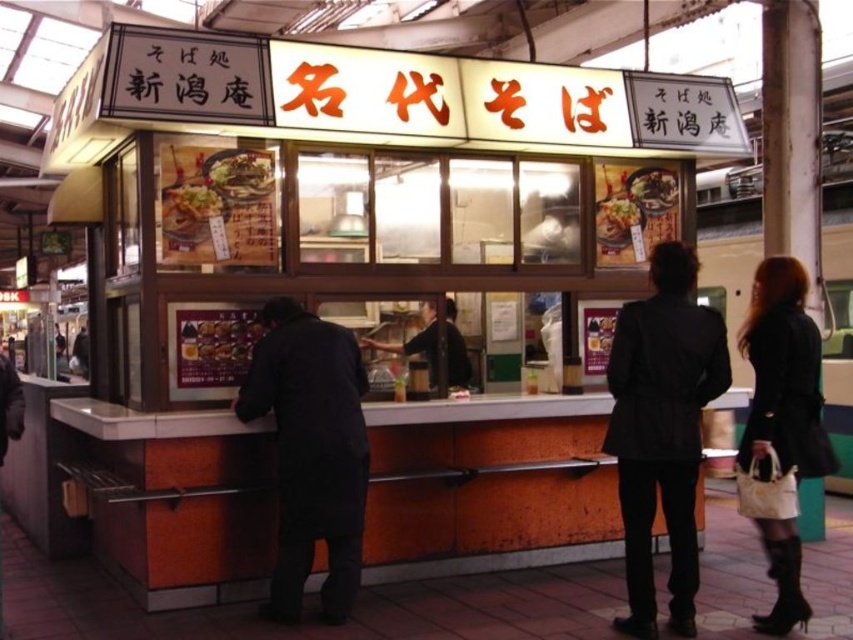
Does black leather coat at right have a greater width compared to shiny plastic bowl at center?

Correct, the width of black leather coat at right exceeds that of shiny plastic bowl at center.

The image size is (853, 640). In order to click on black leather coat at right in this screenshot , I will do `click(781, 429)`.

Where is `black leather coat at right`? Image resolution: width=853 pixels, height=640 pixels. black leather coat at right is located at coordinates (781, 429).

Measure the distance between point (784, 472) and camera.

Point (784, 472) is 3.91 meters away from camera.

Is black leather coat at right positioned in front of shiny plastic food at center?

Yes, black leather coat at right is closer to the viewer.

Who is more forward, [820,356] or [202,355]?

Positioned in front is point [820,356].

Identify the location of black leather coat at right. The width and height of the screenshot is (853, 640). (781, 429).

This screenshot has width=853, height=640. Identify the location of black matte jacket at center. (662, 428).

Between black matte jacket at center and black leather coat at right, which one has more height?

black matte jacket at center

Measure the distance between point (628,531) and camera.

Point (628,531) is 3.99 meters away from camera.

I want to click on black matte jacket at center, so click(662, 428).